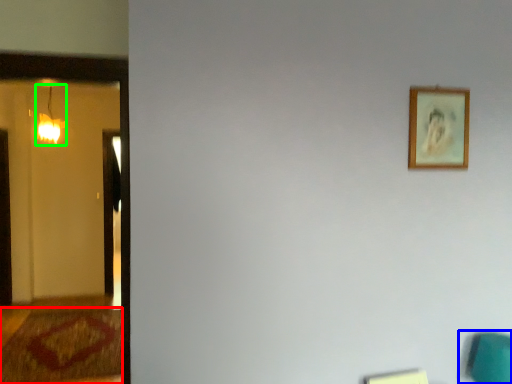
Question: Which is farther away from doormat (highlighted by a red box)? swivel chair (highlighted by a blue box) or lamp (highlighted by a green box)?

Choices:
 (A) swivel chair
 (B) lamp

Answer: (A)